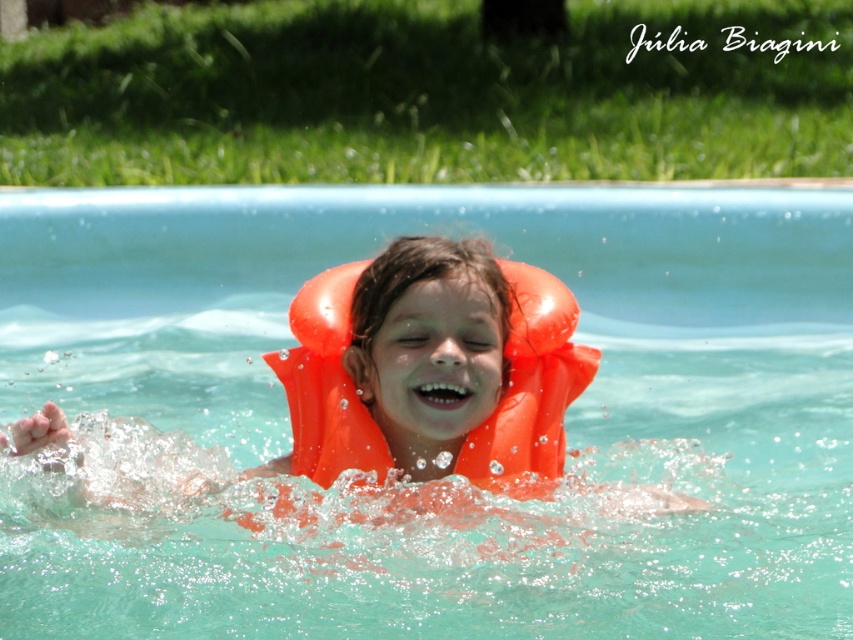
You are a lifeguard standing at the edge of the transparent plastic pool at center and need to reach the orange rubber life jacket at center. Given that you can move at a speed of 1.5 meters per second, how many seconds will it take you to reach it?

The distance between the transparent plastic pool at center and the orange rubber life jacket at center is 3.32 meters. At a speed of 1.5 meters per second, it would take approximately 2.21 seconds to reach the life jacket.

You are a photographer standing at the edge of the transparent plastic pool at center and want to take a photo of the orange rubber life jacket at center. Which object is closer to you, the photographer, so you can focus on it?

The transparent plastic pool at center is closer to you than the orange rubber life jacket at center, so you should focus on the transparent plastic pool at center to capture it clearly.